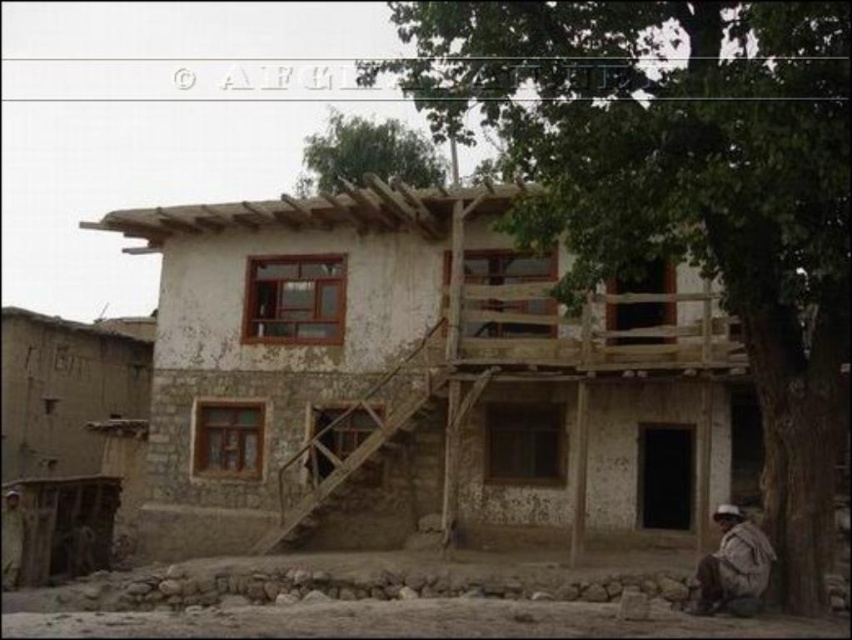
You are standing at the base of the two story building and want to place a new decorative item between the brown fabric hat at lower right and the brown textured fabric at lower left. Given that the distance between them is 17.31 meters, what is the minimum length of the path you need to cover to place the item exactly halfway between them?

The minimum length of the path needed to place the item exactly halfway between the brown fabric hat at lower right and the brown textured fabric at lower left is 8.655 meters, which is half of the total distance of 17.31 meters between them.

You are standing at the origin point of the coordinate system. You want to walk to the white plastered house at center. In which direction should you go?

The white plastered house at center is located at coordinate point (416,381), so you should move northeast to reach it.

You are a photographer planning to capture the white plastered house at center and the green leafy tree at upper right in a single frame. Based on their sizes, which object should you position closer to the camera to ensure both are visible clearly?

The white plastered house at center is larger in size compared to the green leafy tree at upper right. To ensure both are visible clearly in the frame, you should position the green leafy tree at upper right closer to the camera since it is smaller and needs to be enlarged in the composition to balance with the larger house.